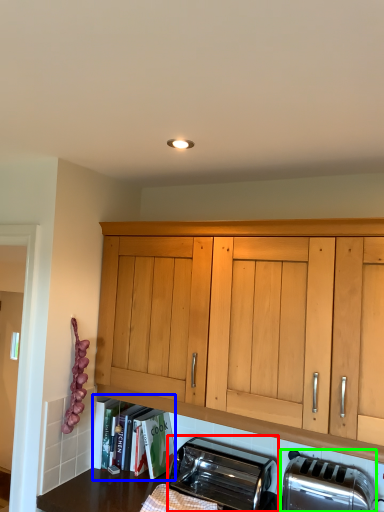
Question: Which object is the closest to the toaster (highlighted by a red box)? Choose among these: shelf (highlighted by a blue box) or toaster (highlighted by a green box).

Choices:
 (A) shelf
 (B) toaster

Answer: (B)